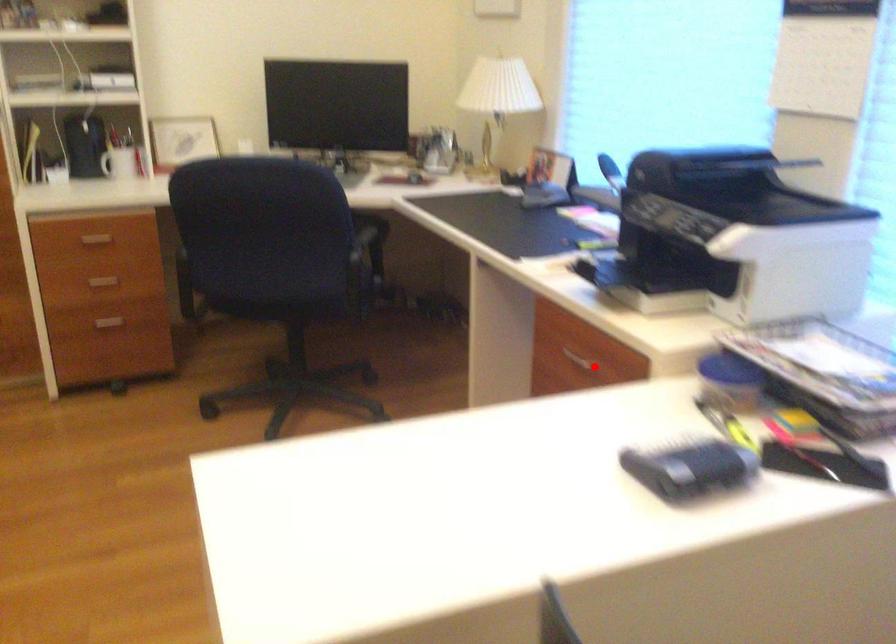
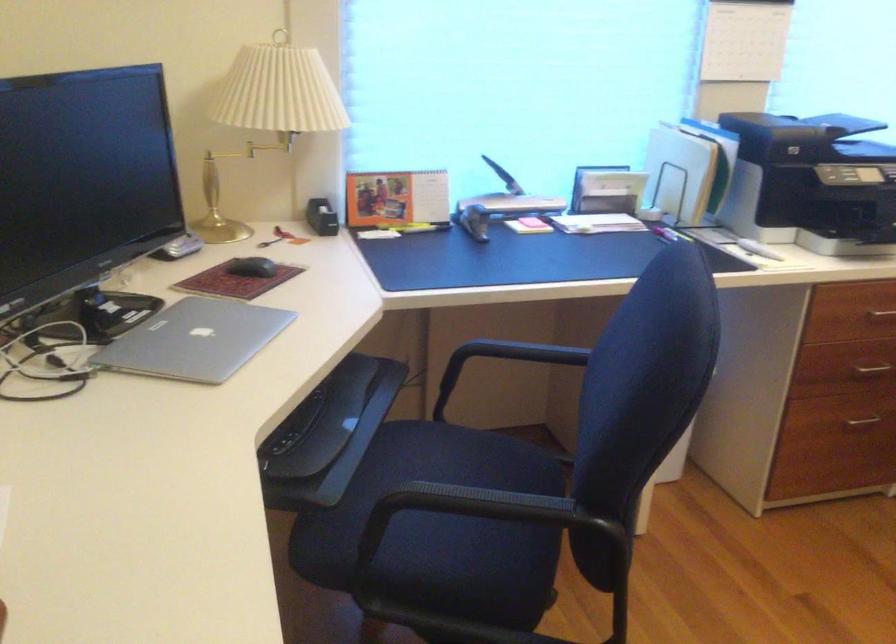
Locate, in the second image, the point that corresponds to the highlighted location in the first image.

(881, 315)